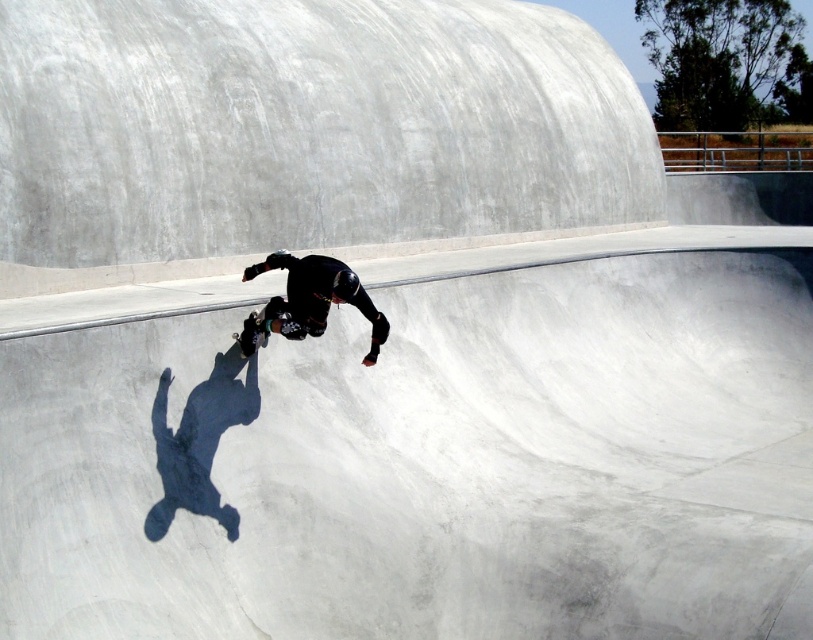
You are a safety inspector evaluating the skatepark. You notice the black matte skateboarder at center and the black matte skateboard at center. Is there a risk of the skateboarder not being properly attached to the skateboard?

The black matte skateboarder at center is positioned over the black matte skateboard at center, which is the correct riding position. Therefore, there is no risk of the skateboarder not being properly attached to the skateboard.

You are a photographer positioned at the edge of the skatepark bowl. You need to capture a clear photo of both the black matte skateboarder at center and the black matte skateboard at center. Considering their sizes, which object will appear larger in your photo?

The black matte skateboarder at center will appear larger in the photo because it is much taller than the black matte skateboard at center.